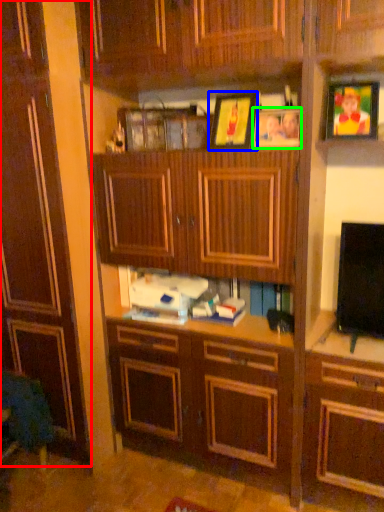
Question: Considering the real-world distances, which object is closest to cabinetry (highlighted by a red box)? picture frame (highlighted by a blue box) or picture frame (highlighted by a green box).

Choices:
 (A) picture frame
 (B) picture frame

Answer: (A)